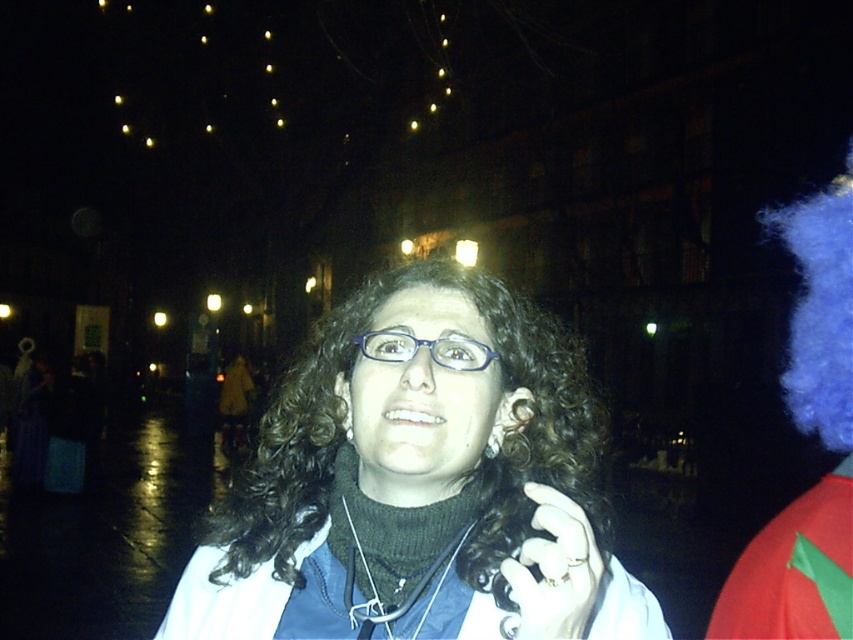
Question: Can you confirm if matte blue jacket at center is bigger than blue fluffy wig at right?

Choices:
 (A) yes
 (B) no

Answer: (A)

Question: Is blue fluffy wig at right smaller than matte blue glasses at center?

Choices:
 (A) yes
 (B) no

Answer: (B)

Question: Which is farther from the blue plastic glasses at center?

Choices:
 (A) matte blue jacket at center
 (B) blue fluffy wig at right

Answer: (B)

Question: Among these points, which one is nearest to the camera?

Choices:
 (A) (384, 330)
 (B) (843, 525)
 (C) (280, 436)

Answer: (A)

Question: Is matte blue jacket at center to the right of blue fluffy wig at right from the viewer's perspective?

Choices:
 (A) yes
 (B) no

Answer: (B)

Question: Which point is farther to the camera?

Choices:
 (A) (258, 456)
 (B) (773, 579)
 (C) (480, 429)
 (D) (463, 340)

Answer: (B)